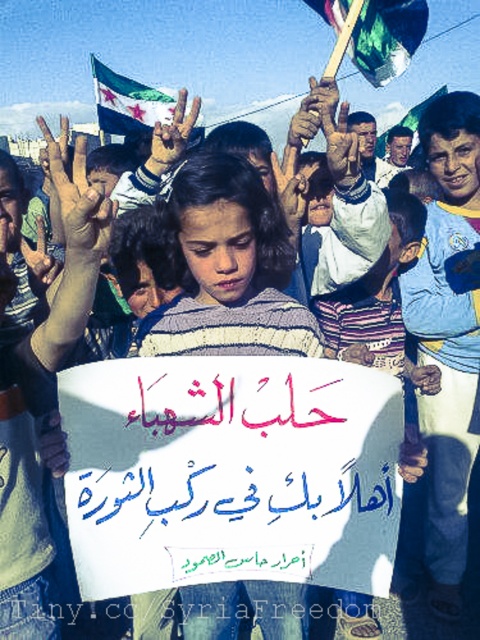
Which is in front, point (96, 195) or point (386, 141)?

Point (96, 195) is more forward.

At what (x,y) coordinates should I click in order to perform the action: click on brown dirt hand at upper center. Please return your answer as a coordinate pair (x, y). This screenshot has width=480, height=640. Looking at the image, I should click on (73, 182).

Image resolution: width=480 pixels, height=640 pixels. In order to click on brown dirt hand at upper center in this screenshot , I will do `click(73, 182)`.

Which is in front, point (372, 12) or point (103, 214)?

Positioned in front is point (103, 214).

The height and width of the screenshot is (640, 480). Find the location of `green glossy flag at upper center`. green glossy flag at upper center is located at coordinates (385, 36).

Does point (385, 49) lie behind point (75, 148)?

Yes, it is behind point (75, 148).

Identify the location of green glossy flag at upper center. (385, 36).

Does striped sweater at center have a lesser width compared to brown dirt hand at upper center?

In fact, striped sweater at center might be wider than brown dirt hand at upper center.

Which is below, striped sweater at center or brown dirt hand at upper center?

striped sweater at center is below.

Is point (268, 252) positioned behind point (97, 204)?

Yes, it is behind point (97, 204).

Where is `striped sweater at center`? striped sweater at center is located at coordinates (228, 268).